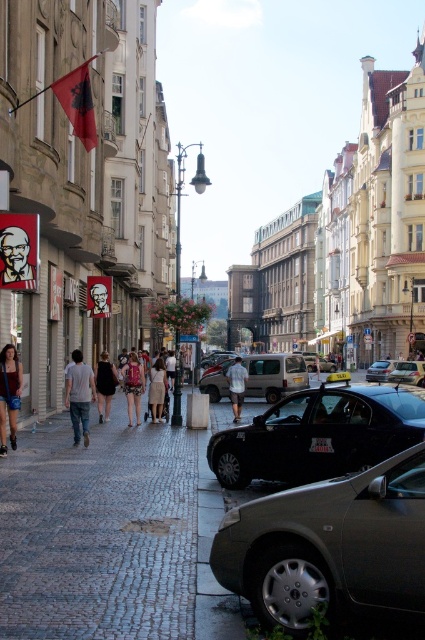
Is shiny black car at center bigger than light blue jeans at center?

Yes, shiny black car at center is bigger than light blue jeans at center.

Identify the location of shiny black car at center. (319, 435).

Who is positioned more to the right, shiny black car at center or black dress at center?

shiny black car at center is more to the right.

Is shiny black car at center shorter than black dress at center?

Indeed, shiny black car at center has a lesser height compared to black dress at center.

What do you see at coordinates (319, 435) in the screenshot? Image resolution: width=425 pixels, height=640 pixels. I see `shiny black car at center` at bounding box center [319, 435].

Where is `shiny black car at center`? This screenshot has height=640, width=425. shiny black car at center is located at coordinates (319, 435).

Image resolution: width=425 pixels, height=640 pixels. What do you see at coordinates (79, 396) in the screenshot? I see `light blue jeans at center` at bounding box center [79, 396].

Is light blue jeans at center further to camera compared to matte black sign at center?

Yes, light blue jeans at center is behind matte black sign at center.

Identify the location of light blue jeans at center. (79, 396).

Locate an element on the screen. This screenshot has width=425, height=640. light blue jeans at center is located at coordinates (79, 396).